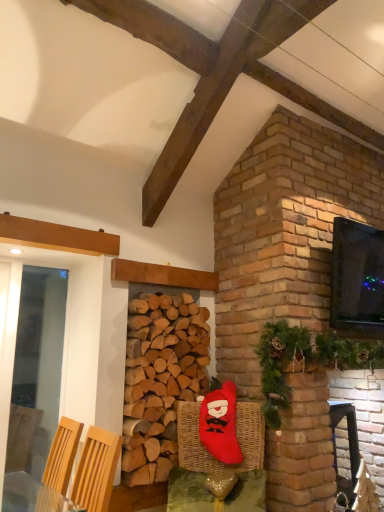
Question: Considering the positions of point (360, 300) and point (66, 481), is point (360, 300) closer or farther from the camera than point (66, 481)?

Choices:
 (A) closer
 (B) farther

Answer: (B)

Question: Visually, is black glossy tv at upper right positioned to the left or to the right of light wood armchair at lower left, arranged as the first armchair when viewed from the front?

Choices:
 (A) right
 (B) left

Answer: (A)

Question: Which of these objects is positioned closest to the black glossy tv at upper right?

Choices:
 (A) green textured garland at upper right
 (B) natural brown wood at center
 (C) red plush santa at center
 (D) light wood armchair at lower left, arranged as the 1th armchair when viewed from the left
 (E) woven wicker basket at lower center

Answer: (A)

Question: Estimate the real-world distances between objects in this image. Which object is farther from the light wood armchair at lower left, arranged as the first armchair when viewed from the front?

Choices:
 (A) transparent glass door at left
 (B) natural brown wood at center
 (C) red plush santa at center
 (D) woven wicker basket at lower center
 (E) woven wicker armchair at lower right, the second armchair from the front

Answer: (A)